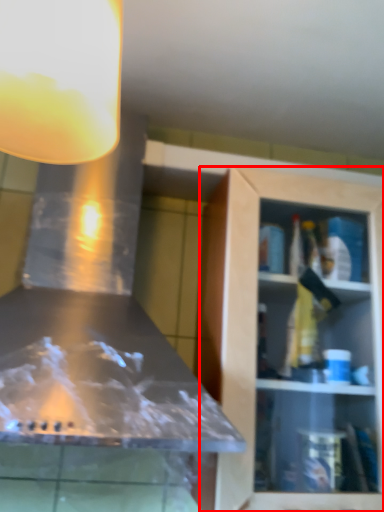
Question: From the image, what is the correct spatial relationship of cabinetry (annotated by the red box) in relation to light fixture?

Choices:
 (A) left
 (B) right

Answer: (B)